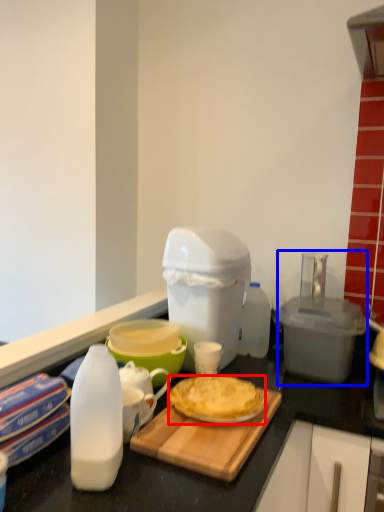
Question: Among these objects, which one is nearest to the camera, dessert (highlighted by a red box) or appliance (highlighted by a blue box)?

Choices:
 (A) dessert
 (B) appliance

Answer: (A)